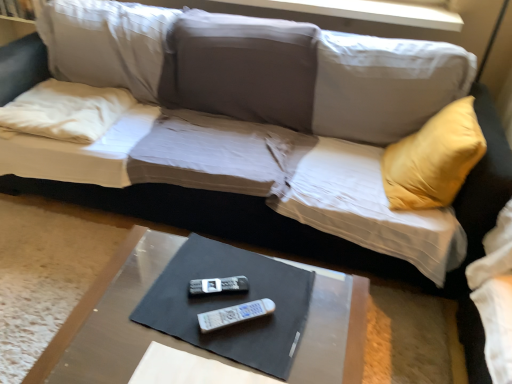
Question: Is white fabric pillow at left behind smooth brown table at lower center?

Choices:
 (A) yes
 (B) no

Answer: (A)

Question: Is white fabric pillow at left smaller than smooth brown table at lower center?

Choices:
 (A) yes
 (B) no

Answer: (A)

Question: Is white fabric pillow at left far from smooth brown table at lower center?

Choices:
 (A) no
 (B) yes

Answer: (A)

Question: Is the surface of white fabric pillow at left in direct contact with smooth brown table at lower center?

Choices:
 (A) no
 (B) yes

Answer: (A)

Question: Could you tell me if white fabric pillow at left is turned towards smooth brown table at lower center?

Choices:
 (A) no
 (B) yes

Answer: (A)

Question: Is white plastic remote at center, the first remote ordered from the bottom, in front of or behind white fabric pillow at left in the image?

Choices:
 (A) front
 (B) behind

Answer: (A)

Question: Is white plastic remote at center, marked as the 2th remote in a back-to-front arrangement, situated inside white fabric pillow at left or outside?

Choices:
 (A) outside
 (B) inside

Answer: (A)

Question: Based on their positions, is white plastic remote at center, the first remote ordered from the bottom, located to the left or right of white fabric pillow at left?

Choices:
 (A) left
 (B) right

Answer: (B)

Question: Considering the positions of white plastic remote at center, the first remote ordered from the bottom, and white fabric pillow at left in the image, is white plastic remote at center, the first remote ordered from the bottom, bigger or smaller than white fabric pillow at left?

Choices:
 (A) big
 (B) small

Answer: (B)

Question: Is smooth brown table at lower center in front of or behind white fabric pillow at left in the image?

Choices:
 (A) front
 (B) behind

Answer: (A)

Question: Considering the positions of smooth brown table at lower center and white fabric pillow at left in the image, is smooth brown table at lower center wider or thinner than white fabric pillow at left?

Choices:
 (A) thin
 (B) wide

Answer: (B)

Question: Is point (340, 336) positioned closer to the camera than point (67, 99)?

Choices:
 (A) closer
 (B) farther

Answer: (A)

Question: Considering the relative positions of smooth brown table at lower center and white fabric pillow at left in the image provided, is smooth brown table at lower center to the left or to the right of white fabric pillow at left?

Choices:
 (A) left
 (B) right

Answer: (B)

Question: Is white fabric pillow at left taller or shorter than smooth brown table at lower center?

Choices:
 (A) tall
 (B) short

Answer: (B)

Question: Would you say white fabric pillow at left is to the left or to the right of smooth brown table at lower center in the picture?

Choices:
 (A) left
 (B) right

Answer: (A)